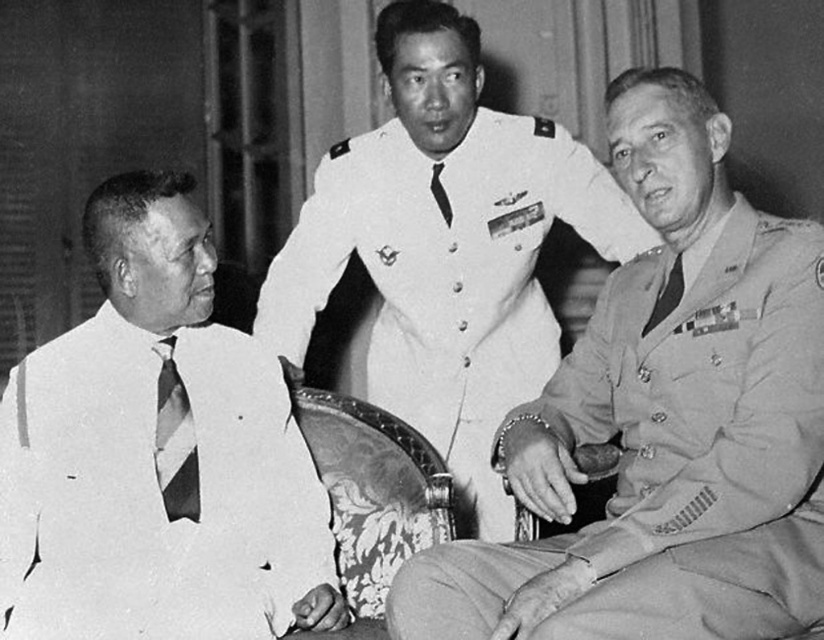
In the image, there are three individuals seated indoors. The individual on the left is wearing a light colored suit with a tie, and the individual in the center is wearing a military uniform with a white jacket and tie. There is also a point marked at coordinates (157, 454) which marks a white striped tie at left. Which individual is wearing the white striped tie at left?

The individual on the left is wearing the white striped tie at left as indicated by the point marked at coordinates (157, 454).

You are a photographer who needs to ensure that all ties in the image are visible in the final portrait. Given the white striped tie at left and the matte striped tie at right, which tie might require adjustment to ensure it doesn not get cropped out of the frame?

The white striped tie at left has a greater height compared to the matte striped tie at right, so it might require more careful framing to ensure it is fully visible in the photograph.